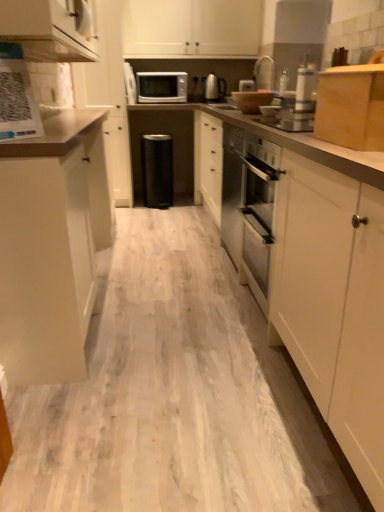
Question: Is wooden box at upper right, the first cabinetry in the right-to-left sequence, further to camera compared to matte white cabinet at left, which appears as the 3th cabinetry when viewed from the left?

Choices:
 (A) no
 (B) yes

Answer: (A)

Question: Can you confirm if wooden box at upper right, the 5th cabinetry when ordered from left to right, is positioned to the right of matte white cabinet at left, which appears as the 3th cabinetry when viewed from the left?

Choices:
 (A) no
 (B) yes

Answer: (B)

Question: From a real-world perspective, is wooden box at upper right, the first cabinetry in the right-to-left sequence, located higher than matte white cabinet at left, acting as the third cabinetry starting from the right?

Choices:
 (A) yes
 (B) no

Answer: (A)

Question: From the image's perspective, is wooden box at upper right, the first cabinetry in the right-to-left sequence, beneath matte white cabinet at left, which appears as the 3th cabinetry when viewed from the left?

Choices:
 (A) no
 (B) yes

Answer: (A)

Question: Could you tell me if wooden box at upper right, the first cabinetry in the right-to-left sequence, is turned towards matte white cabinet at left, which appears as the 3th cabinetry when viewed from the left?

Choices:
 (A) no
 (B) yes

Answer: (A)

Question: From their relative heights in the image, would you say matte white cabinet at left, acting as the third cabinetry starting from the right, is taller or shorter than metallic silver kettle at upper center, positioned as the second appliance in right-to-left order?

Choices:
 (A) short
 (B) tall

Answer: (B)

Question: From a real-world perspective, relative to metallic silver kettle at upper center, which is counted as the third appliance, starting from the front, is matte white cabinet at left, which appears as the 3th cabinetry when viewed from the left, vertically above or below?

Choices:
 (A) above
 (B) below

Answer: (B)

Question: Visually, is matte white cabinet at left, which appears as the 3th cabinetry when viewed from the left, positioned to the left or to the right of metallic silver kettle at upper center, the second appliance when ordered from left to right?

Choices:
 (A) right
 (B) left

Answer: (B)

Question: Considering the positions of point (21, 258) and point (223, 93), is point (21, 258) closer or farther from the camera than point (223, 93)?

Choices:
 (A) closer
 (B) farther

Answer: (A)

Question: Considering the positions of point (16, 72) and point (297, 181), is point (16, 72) closer or farther from the camera than point (297, 181)?

Choices:
 (A) closer
 (B) farther

Answer: (B)

Question: In terms of height, does white glossy qr code at upper left look taller or shorter compared to white laminate countertop at center?

Choices:
 (A) tall
 (B) short

Answer: (A)

Question: From the image's perspective, relative to white laminate countertop at center, is white glossy qr code at upper left above or below?

Choices:
 (A) above
 (B) below

Answer: (A)

Question: Choose the correct answer: Is white glossy qr code at upper left inside white laminate countertop at center or outside it?

Choices:
 (A) inside
 (B) outside

Answer: (B)

Question: Is metallic silver toaster at upper center, the first appliance from the front, to the left or to the right of white glossy microwave oven at upper center in the image?

Choices:
 (A) right
 (B) left

Answer: (A)

Question: From the image's perspective, is metallic silver toaster at upper center, the first appliance from the front, located above or below white glossy microwave oven at upper center?

Choices:
 (A) above
 (B) below

Answer: (B)